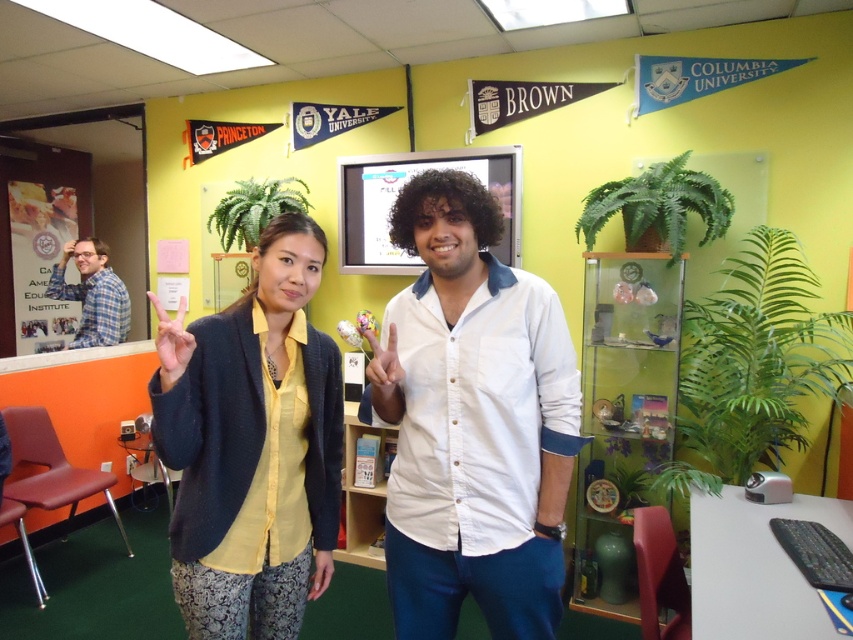
You are organizing a photoshoot and need to ensure that the green leafy plant at right and the plaid fabric shirt at left are both visible in the frame. Based on their positions, which object is closer to the camera?

The green leafy plant at right is closer to the camera because it is in front of the plaid fabric shirt at left.

You are organizing a photo shoot and need to ensure that all clothing items are visible. Given that the white cotton shirt at center and the plaid fabric shirt at left are both in the frame, which one should you adjust to make sure both are fully visible?

Since the white cotton shirt at center occupies less space than the plaid fabric shirt at left, you should adjust the plaid fabric shirt at left first because it takes up more space and might be blocking part of the white cotton shirt at center.

In the scene shown: You are organizing a photo shoot and need to adjust the clothing items in the image. The white cotton shirt at center and plaid fabric shirt at left are both visible in the photo. Which shirt is located lower in the frame?

The white cotton shirt at center is positioned under the plaid fabric shirt at left, meaning it is lower in the frame.